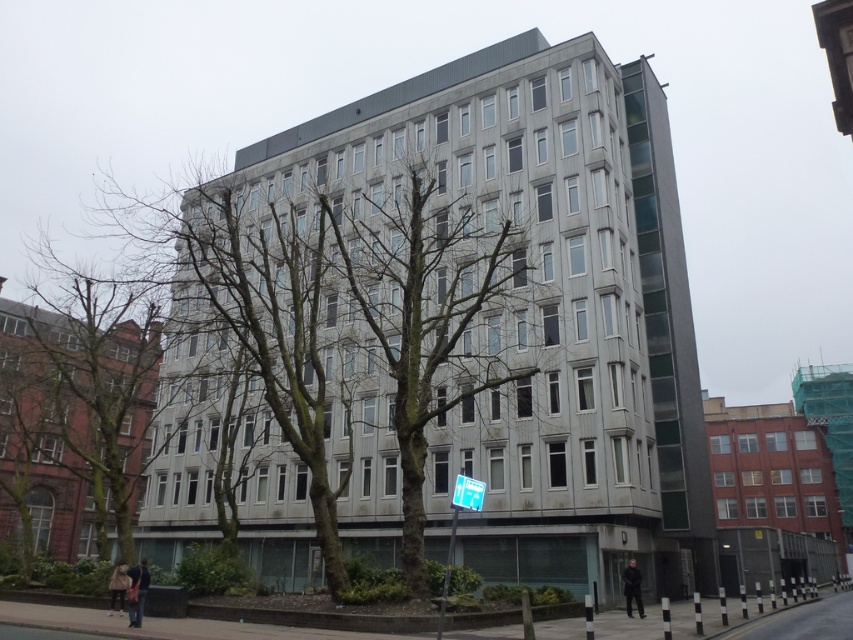
Question: Which object is positioned closest to the bare wood tree at center?

Choices:
 (A) blue plastic sign at lower center
 (B) white plastic street sign at center

Answer: (A)

Question: Is blue plastic sign at lower center below white plastic street sign at center?

Choices:
 (A) yes
 (B) no

Answer: (A)

Question: Among these points, which one is farthest from the camera?

Choices:
 (A) (450, 570)
 (B) (473, 496)
 (C) (483, 369)

Answer: (C)

Question: Is bare wood tree at center positioned before white plastic street sign at center?

Choices:
 (A) no
 (B) yes

Answer: (A)

Question: Is blue plastic sign at lower center thinner than white plastic street sign at center?

Choices:
 (A) yes
 (B) no

Answer: (B)

Question: Estimate the real-world distances between objects in this image. Which object is closer to the white plastic street sign at center?

Choices:
 (A) bare wood tree at center
 (B) blue plastic sign at lower center

Answer: (B)